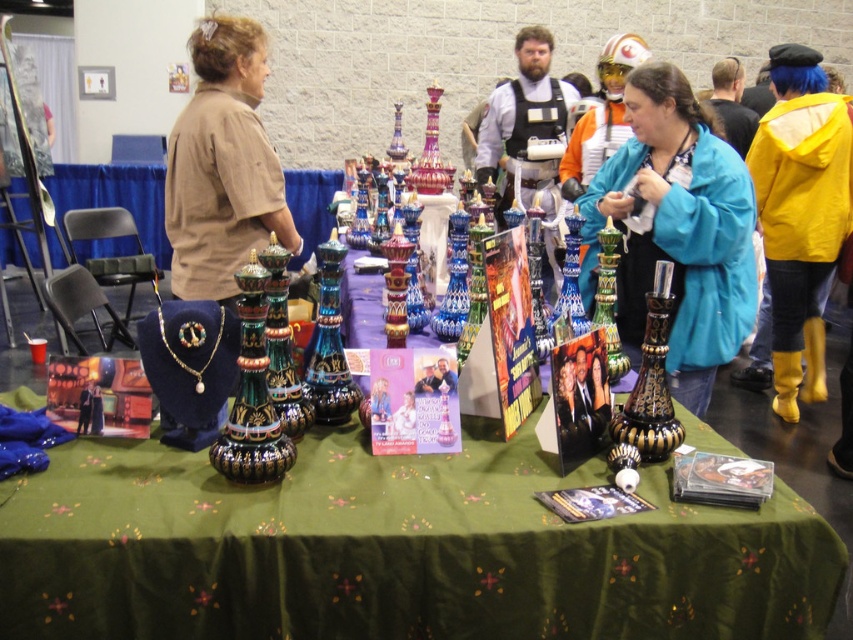
Question: Does multicolored glass vase at center appear under shiny black glass vase at center?

Choices:
 (A) no
 (B) yes

Answer: (B)

Question: Is teal matte jacket at center further to the viewer compared to shiny black glass vase at center?

Choices:
 (A) no
 (B) yes

Answer: (B)

Question: Considering the real-world distances, which object is closest to the multicolored glass vase at center?

Choices:
 (A) teal matte jacket at center
 (B) shiny black glass vase at center

Answer: (B)

Question: Does teal matte jacket at center have a larger size compared to shiny black glass vase at center?

Choices:
 (A) no
 (B) yes

Answer: (B)

Question: Which is farther from the shiny black glass vase at center?

Choices:
 (A) multicolored glass vase at center
 (B) teal matte jacket at center

Answer: (B)

Question: Which object is positioned farthest from the shiny black glass vase at center?

Choices:
 (A) multicolored glass vase at center
 (B) teal matte jacket at center

Answer: (B)